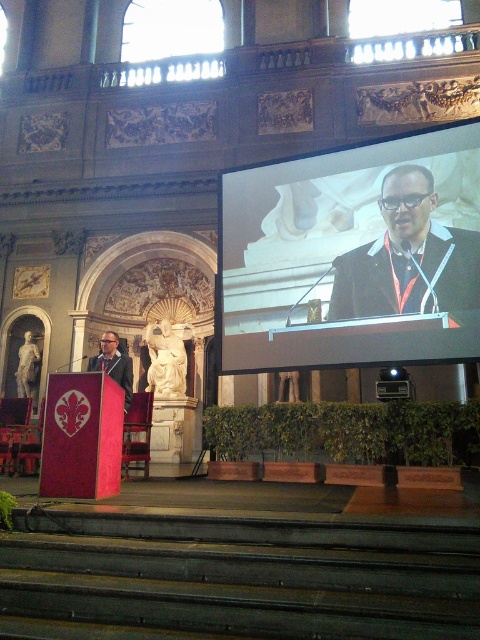
Is black matte suit at upper center to the left of matte black podium at left from the viewer's perspective?

No, black matte suit at upper center is not to the left of matte black podium at left.

Can you confirm if black matte suit at upper center is shorter than matte black podium at left?

Incorrect, black matte suit at upper center's height does not fall short of matte black podium at left's.

Does point (411, 188) come behind point (108, 337)?

No, it is in front of (108, 337).

I want to click on black matte suit at upper center, so click(408, 257).

Is matte black screen at upper center below black matte suit at upper center?

No.

Can you confirm if matte black screen at upper center is positioned to the left of black matte suit at upper center?

Yes, matte black screen at upper center is to the left of black matte suit at upper center.

Who is more forward, (454,218) or (360,312)?

Point (454,218) is in front.

The height and width of the screenshot is (640, 480). In order to click on matte black screen at upper center in this screenshot , I will do `click(352, 256)`.

Does matte black screen at upper center come behind matte black podium at left?

No, it is in front of matte black podium at left.

Is point (469, 305) farther from viewer compared to point (126, 404)?

No, (469, 305) is in front of (126, 404).

What are the coordinates of `matte black screen at upper center` in the screenshot? It's located at (352, 256).